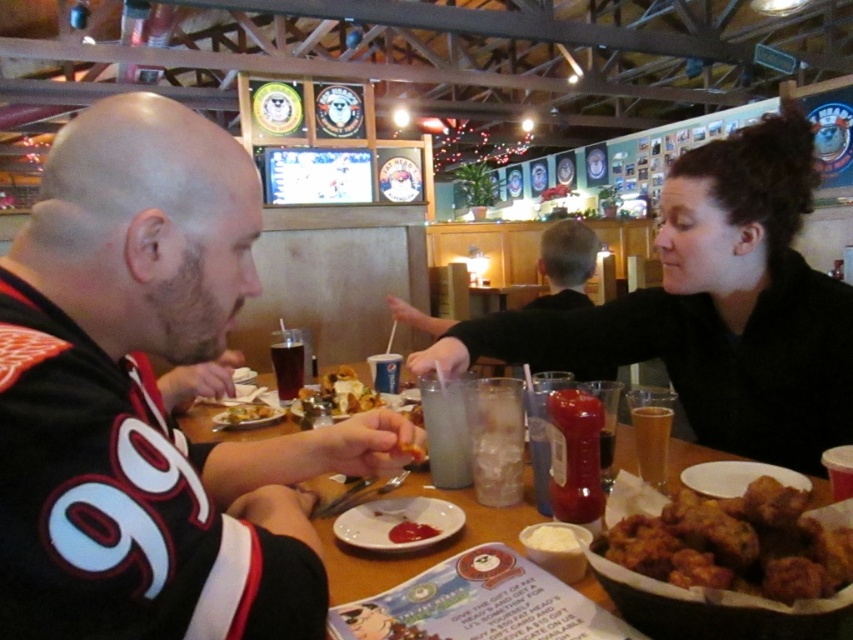
Question: Considering the real-world distances, which object is closest to the golden crispy chicken at lower right?

Choices:
 (A) golden crispy chicken at center
 (B) clear plastic cup at center
 (C) translucent glass beer at table center
 (D) translucent glass cup at table center

Answer: (D)

Question: Does brown wooden table at center lie in front of smooth tomato paste at center?

Choices:
 (A) yes
 (B) no

Answer: (A)

Question: Which object is closer to the camera taking this photo?

Choices:
 (A) yellow fried chicken at center
 (B) black jersey at center

Answer: (B)

Question: Is white matte plate at center wider than yellow fried chicken at center?

Choices:
 (A) no
 (B) yes

Answer: (B)

Question: Which of the following is the closest to the observer?

Choices:
 (A) (231, 204)
 (B) (662, 406)
 (C) (427, 531)
 (D) (440, 433)

Answer: (A)

Question: From the image, what is the correct spatial relationship of black jersey at center in relation to black matte jacket at upper right?

Choices:
 (A) right
 (B) left

Answer: (B)